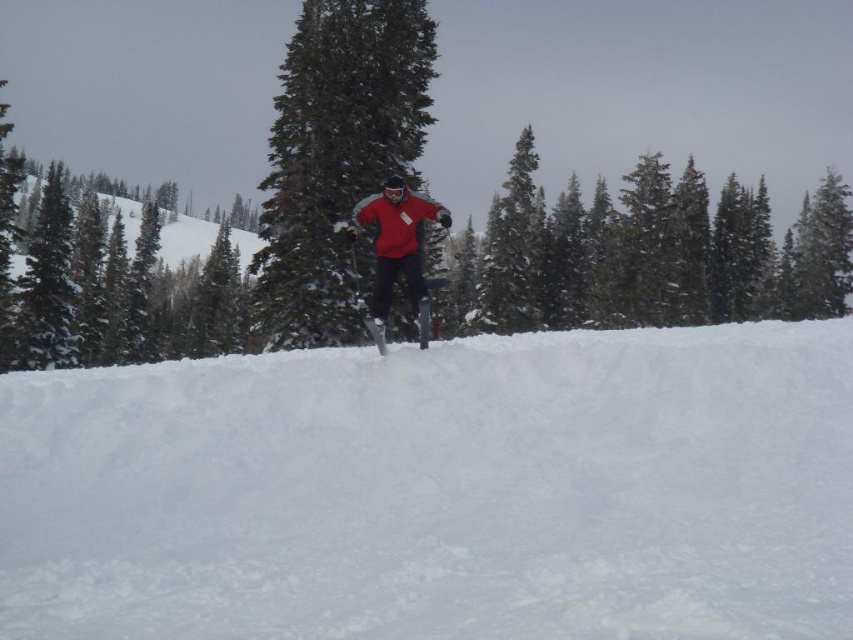
You are standing at the bottom of the slope and see the matte red snowboarder at center. If you want to locate them precisely, what are their coordinates?

The matte red snowboarder at center is located at coordinates point (396, 250).

You are a drone operator trying to capture a photo of the person in the midground. The drone is currently hovering above the white fluffy snow at center. To get the best shot, you need to move the drone to the exact location of the person. What are the coordinates you should input into the drone to adjust its position?

The coordinates for the person in the midground are not provided in the scene description. The only coordinate given is for the white fluffy snow at center, which is at point (439,490). Without additional information about the person, it is impossible to determine their exact coordinates.